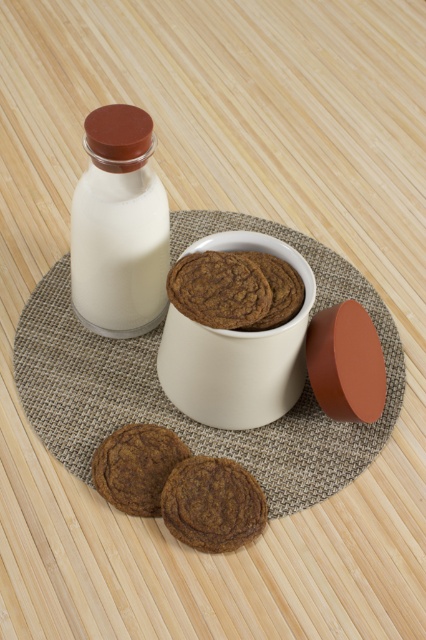
Who is higher up, matte white bowl at center or chocolate chip cookie at lower left?

matte white bowl at center is above.

This screenshot has height=640, width=426. I want to click on matte white bowl at center, so click(x=236, y=353).

Where is `matte white bowl at center`? The image size is (426, 640). matte white bowl at center is located at coordinates (236, 353).

Who is lower down, textured beige placemat at center or chocolate chip cookie at lower left?

Positioned lower is chocolate chip cookie at lower left.

Which of these two, textured beige placemat at center or chocolate chip cookie at lower left, stands taller?

Standing taller between the two is textured beige placemat at center.

Where is `textured beige placemat at center`? The width and height of the screenshot is (426, 640). textured beige placemat at center is located at coordinates (172, 404).

Can you confirm if textured beige placemat at center is bigger than matte white bowl at center?

Correct, textured beige placemat at center is larger in size than matte white bowl at center.

Between textured beige placemat at center and matte white bowl at center, which one is positioned higher?

matte white bowl at center is above.

The height and width of the screenshot is (640, 426). I want to click on textured beige placemat at center, so click(172, 404).